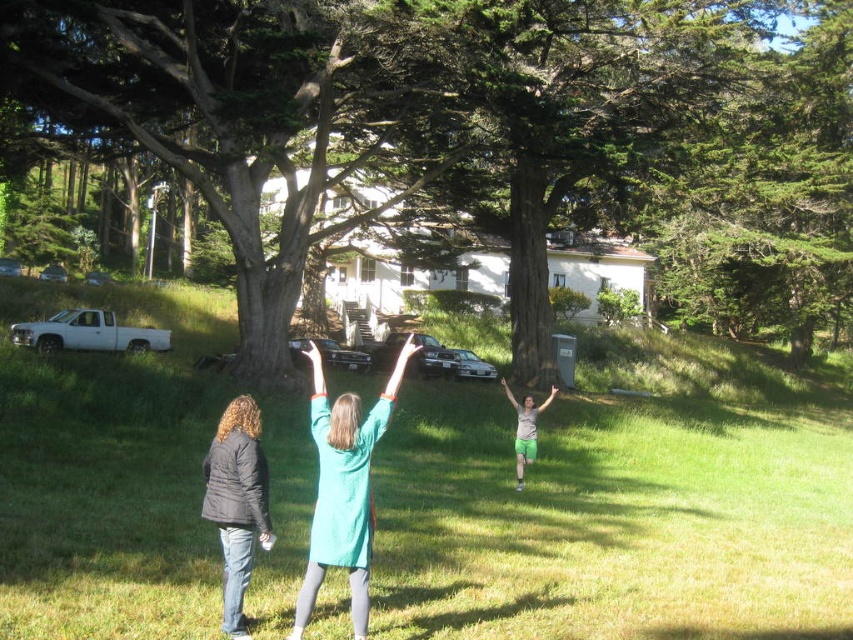
Question: Which object is the farthest from the teal fabric dress at center?

Choices:
 (A) green fabric pants at center
 (B) green textured tree at center

Answer: (B)

Question: Which of the following is the farthest from the observer?

Choices:
 (A) (49, 305)
 (B) (287, 144)
 (C) (225, 529)
 (D) (305, 602)

Answer: (A)

Question: Can you confirm if black puffy jacket at lower left is bigger than green fabric pants at center?

Choices:
 (A) yes
 (B) no

Answer: (B)

Question: Can you confirm if green grass at center is wider than green textured tree at center?

Choices:
 (A) yes
 (B) no

Answer: (B)

Question: From the image, what is the correct spatial relationship of green textured tree at center in relation to teal fabric dress at center?

Choices:
 (A) below
 (B) above

Answer: (B)

Question: Which of the following is the closest to the observer?

Choices:
 (A) (390, 554)
 (B) (310, 563)
 (C) (277, 346)
 (D) (509, 388)

Answer: (B)